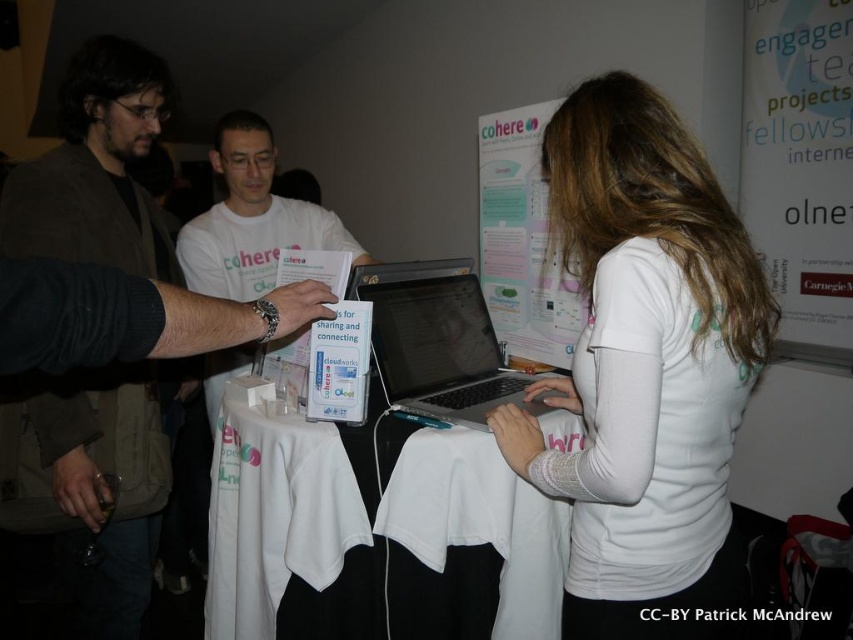
Question: Where is white paper at upper right located in relation to white matte t-shirt at center in the image?

Choices:
 (A) left
 (B) right

Answer: (B)

Question: Can you confirm if white matte shirt at center is positioned below matte black laptop at left?

Choices:
 (A) no
 (B) yes

Answer: (B)

Question: Which of the following is the farthest from the observer?

Choices:
 (A) (294, 230)
 (B) (364, 298)

Answer: (A)

Question: Based on their relative distances, which object is farther from the satin silver laptop at center?

Choices:
 (A) white paper at center
 (B) white paper at upper right
 (C) matte black laptop at left

Answer: (B)

Question: Observing the image, what is the correct spatial positioning of white paper at upper right in reference to satin silver laptop at center?

Choices:
 (A) below
 (B) above

Answer: (B)

Question: Which is nearer to the white cloth-covered table at center?

Choices:
 (A) satin silver laptop at center
 (B) matte black laptop at left

Answer: (A)